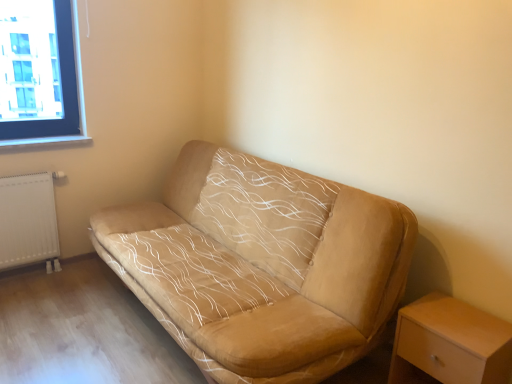
Question: Is the depth of light wood/wooden nightstand at lower right less than that of suede beige couch at center?

Choices:
 (A) yes
 (B) no

Answer: (B)

Question: From a real-world perspective, is light wood/wooden nightstand at lower right positioned under suede beige couch at center based on gravity?

Choices:
 (A) no
 (B) yes

Answer: (B)

Question: From the image's perspective, does light wood/wooden nightstand at lower right appear lower than suede beige couch at center?

Choices:
 (A) no
 (B) yes

Answer: (B)

Question: Is light wood/wooden nightstand at lower right aimed at suede beige couch at center?

Choices:
 (A) yes
 (B) no

Answer: (B)

Question: Is light wood/wooden nightstand at lower right placed right next to suede beige couch at center?

Choices:
 (A) yes
 (B) no

Answer: (B)

Question: Is light wood/wooden nightstand at lower right positioned with its back to suede beige couch at center?

Choices:
 (A) yes
 (B) no

Answer: (B)

Question: Can you confirm if white matte radiator at lower left is positioned to the right of suede beige couch at center?

Choices:
 (A) yes
 (B) no

Answer: (B)

Question: Is white matte radiator at lower left surrounding suede beige couch at center?

Choices:
 (A) yes
 (B) no

Answer: (B)

Question: Is white matte radiator at lower left next to suede beige couch at center and touching it?

Choices:
 (A) no
 (B) yes

Answer: (A)

Question: Is white matte radiator at lower left outside of suede beige couch at center?

Choices:
 (A) yes
 (B) no

Answer: (A)

Question: Does white matte radiator at lower left lie in front of suede beige couch at center?

Choices:
 (A) yes
 (B) no

Answer: (B)

Question: Would you consider white matte radiator at lower left to be distant from suede beige couch at center?

Choices:
 (A) no
 (B) yes

Answer: (B)

Question: From the image's perspective, does white matte radiator at lower left appear higher than light wood/wooden nightstand at lower right?

Choices:
 (A) yes
 (B) no

Answer: (A)